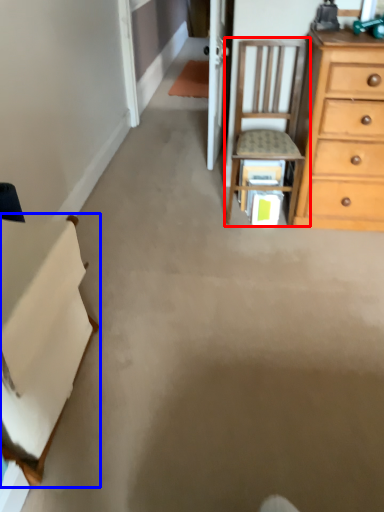
Question: Which object appears farthest to the camera in this image, chair (highlighted by a red box) or cabinetry (highlighted by a blue box)?

Choices:
 (A) chair
 (B) cabinetry

Answer: (A)